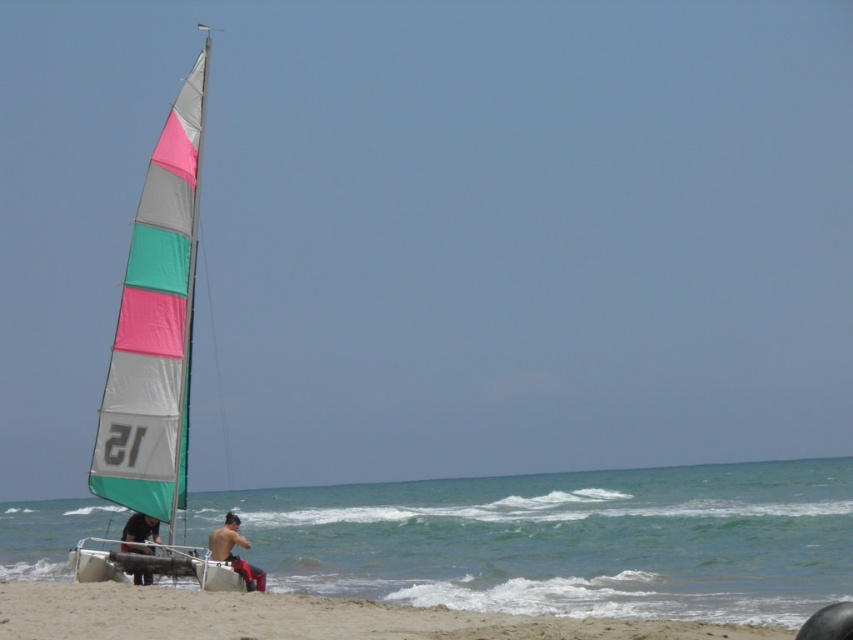
Is multicolored fabric sailboat at left wider than dark brown leather jacket at lower left?

Yes, multicolored fabric sailboat at left is wider than dark brown leather jacket at lower left.

Does multicolored fabric sailboat at left have a larger size compared to dark brown leather jacket at lower left?

Indeed, multicolored fabric sailboat at left has a larger size compared to dark brown leather jacket at lower left.

Does point (169, 248) come behind point (140, 577)?

Yes, it is.

Identify the location of multicolored fabric sailboat at left. (155, 324).

Is multicolored fabric sailboat at left thinner than sandy beach at lower left?

No.

Can you confirm if multicolored fabric sailboat at left is positioned below sandy beach at lower left?

No.

Between point (94, 456) and point (390, 612), which one is positioned behind?

The point (94, 456) is behind.

At what (x,y) coordinates should I click in order to perform the action: click on multicolored fabric sailboat at left. Please return your answer as a coordinate pair (x, y). Looking at the image, I should click on (155, 324).

Can you confirm if multicolored fabric sailboat at left is positioned to the right of shiny red shorts at lower center?

Yes, multicolored fabric sailboat at left is to the right of shiny red shorts at lower center.

Find the location of `multicolored fabric sailboat at left`. multicolored fabric sailboat at left is located at coordinates (155, 324).

You are a GUI agent. You are given a task and a screenshot of the screen. Output one action in this format:
    pyautogui.click(x=<x>, y=<y>)
    Task: Click on the multicolored fabric sailboat at left
    Image resolution: width=853 pixels, height=640 pixels.
    Given the screenshot: What is the action you would take?
    pyautogui.click(x=155, y=324)